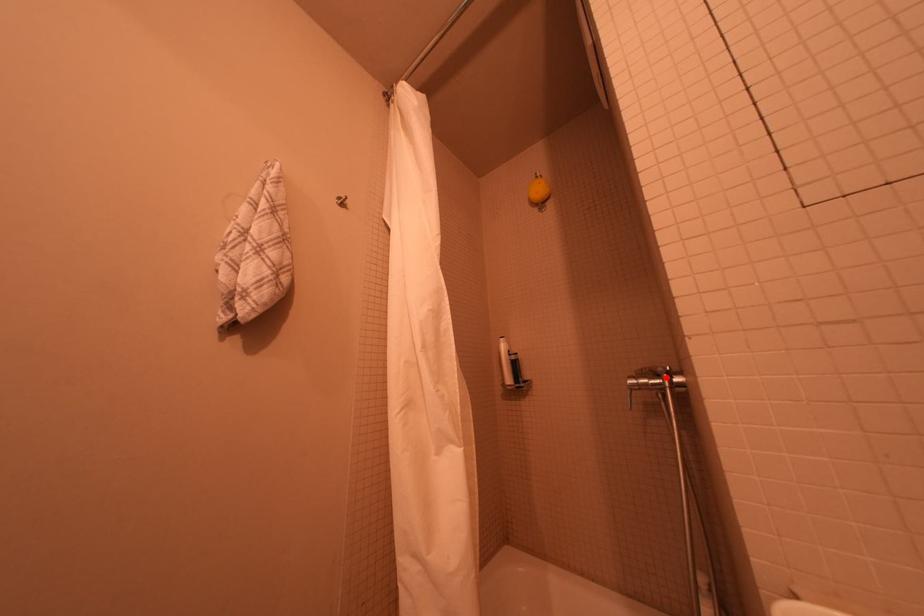
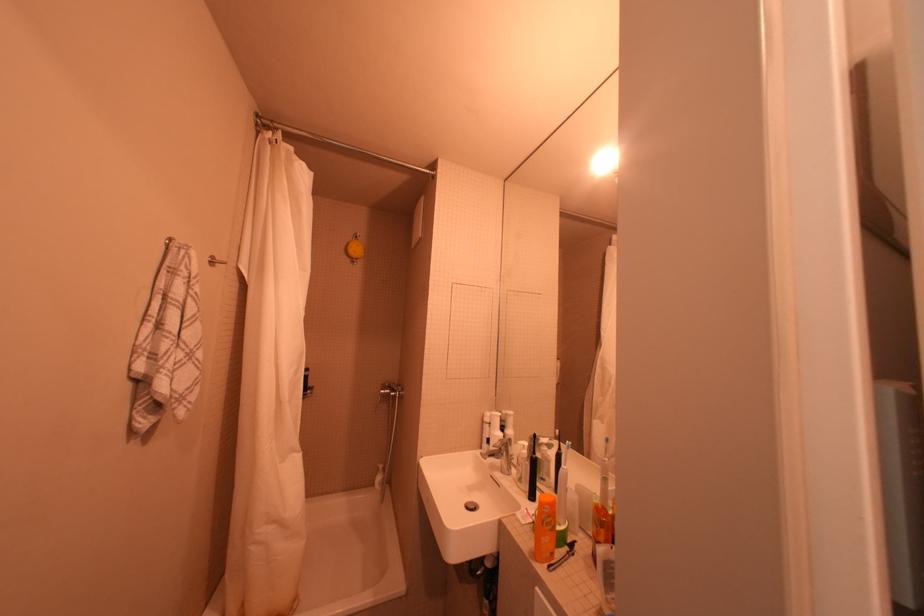
Question: I am providing you with two images of the same scene from different viewpoints. A red point is marked on the first image. Is the red point's position out of view in image 2?

Choices:
 (A) Yes
 (B) No

Answer: (B)